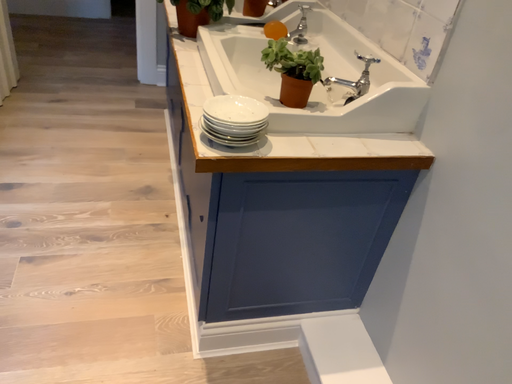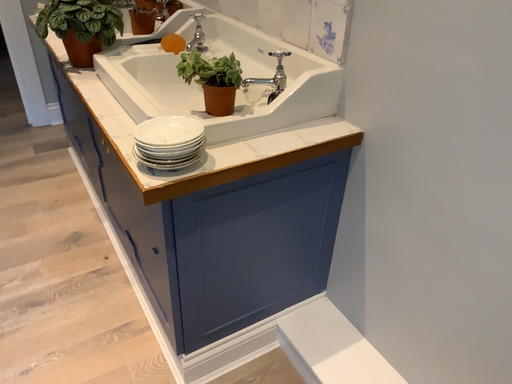
Question: How did the camera likely rotate when shooting the video?

Choices:
 (A) rotated left
 (B) rotated right

Answer: (B)